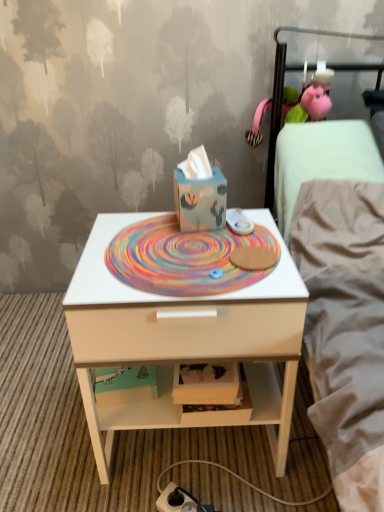
Locate an element on the screen. free point below multicolored woven mat at center (from a real-world perspective) is located at coordinates (179, 253).